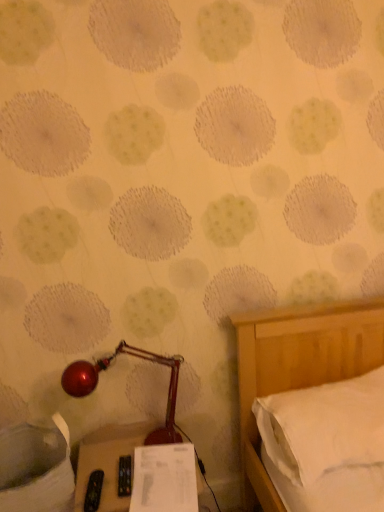
This screenshot has height=512, width=384. What do you see at coordinates (108, 461) in the screenshot?
I see `black plastic remote control at lower center` at bounding box center [108, 461].

What do you see at coordinates (324, 426) in the screenshot? I see `white soft pillow at right` at bounding box center [324, 426].

What is the approximate height of white soft pillow at right?

white soft pillow at right is 9.24 inches in height.

The height and width of the screenshot is (512, 384). Find the location of `white paper at lower center`. white paper at lower center is located at coordinates (164, 479).

The width and height of the screenshot is (384, 512). Describe the element at coordinates (164, 479) in the screenshot. I see `white paper at lower center` at that location.

You are a GUI agent. You are given a task and a screenshot of the screen. Output one action in this format:
    pyautogui.click(x=<x>, y=<y>)
    Task: Click on the black plastic remote control at lower center
    
    Given the screenshot: What is the action you would take?
    pyautogui.click(x=108, y=461)

Is black plastic remote control at lower center directly adjacent to shiny red lamp at lower left?

black plastic remote control at lower center and shiny red lamp at lower left are clearly separated.

Is black plastic remote control at lower center taller than shiny red lamp at lower left?

Incorrect, the height of black plastic remote control at lower center is not larger of that of shiny red lamp at lower left.

What's the angular difference between black plastic remote control at lower center and shiny red lamp at lower left's facing directions?

The angle between the facing direction of black plastic remote control at lower center and the facing direction of shiny red lamp at lower left is 12.9 degrees.

Considering the positions of objects black plastic remote control at lower center and shiny red lamp at lower left in the image provided, who is more to the left, black plastic remote control at lower center or shiny red lamp at lower left?

From the viewer's perspective, shiny red lamp at lower left appears more on the left side.

Can you confirm if white soft pillow at right is wider than shiny red lamp at lower left?

Correct, the width of white soft pillow at right exceeds that of shiny red lamp at lower left.

From the image's perspective, between white soft pillow at right and shiny red lamp at lower left, who is located below?

white soft pillow at right, from the image's perspective.

Is white soft pillow at right positioned in front of shiny red lamp at lower left?

That is True.

Is white soft pillow at right turned away from shiny red lamp at lower left?

That's not correct — white soft pillow at right is not looking away from shiny red lamp at lower left.

Which of these two, white paper at lower center or white soft pillow at right, is smaller?

white paper at lower center.

Where is `paper below the white soft pillow at right (from the image's perspective)`? paper below the white soft pillow at right (from the image's perspective) is located at coordinates (164, 479).

Is white paper at lower center oriented away from white soft pillow at right?

No, white paper at lower center is not facing away from white soft pillow at right.

How different are the orientations of white paper at lower center and white soft pillow at right in degrees?

8.12 degrees separate the facing orientations of white paper at lower center and white soft pillow at right.

Considering the sizes of objects shiny red lamp at lower left and white soft pillow at right in the image provided, who is bigger, shiny red lamp at lower left or white soft pillow at right?

With larger size is white soft pillow at right.

Is white soft pillow at right completely or partially inside shiny red lamp at lower left?

No, white soft pillow at right is not inside shiny red lamp at lower left.

From the image's perspective, is shiny red lamp at lower left located above white soft pillow at right?

Yes, from the image's perspective, shiny red lamp at lower left is over white soft pillow at right.

How many degrees apart are the facing directions of shiny red lamp at lower left and white soft pillow at right?

12.8 degrees.

Could you tell me if white paper at lower center is facing shiny red lamp at lower left?

No.

Considering the positions of objects white paper at lower center and shiny red lamp at lower left in the image provided, who is more to the right, white paper at lower center or shiny red lamp at lower left?

Positioned to the right is white paper at lower center.

There is a white paper at lower center. Where is `lamp above it (from a real-world perspective)`? lamp above it (from a real-world perspective) is located at coordinates (107, 368).

Is white paper at lower center thinner than shiny red lamp at lower left?

No.

Considering the relative positions of white soft pillow at right and black plastic remote control at lower center in the image provided, is white soft pillow at right to the right of black plastic remote control at lower center from the viewer's perspective?

Yes.

Does white soft pillow at right lie in front of black plastic remote control at lower center?

No, the depth of white soft pillow at right is greater than that of black plastic remote control at lower center.

Is white soft pillow at right taller than black plastic remote control at lower center?

In fact, white soft pillow at right may be shorter than black plastic remote control at lower center.

From a real-world perspective, who is located higher, black plastic remote control at lower center or white soft pillow at right?

white soft pillow at right.

How different are the orientations of black plastic remote control at lower center and white soft pillow at right in degrees?

The facing directions of black plastic remote control at lower center and white soft pillow at right are 0.023 degrees apart.

Is black plastic remote control at lower center next to white soft pillow at right?

No.

Based on their sizes in the image, would you say black plastic remote control at lower center is bigger or smaller than white soft pillow at right?

Clearly, black plastic remote control at lower center is larger in size than white soft pillow at right.

Identify the location of furniture below the shiny red lamp at lower left (from the image's perspective). [x=108, y=461].

The height and width of the screenshot is (512, 384). Find the location of `lamp that is above the white soft pillow at right (from the image's perspective)`. lamp that is above the white soft pillow at right (from the image's perspective) is located at coordinates (107, 368).

Estimate the real-world distances between objects in this image. Which object is closer to shiny red lamp at lower left, white paper at lower center or white soft pillow at right?

The object closer to shiny red lamp at lower left is white paper at lower center.

When comparing their distances from white soft pillow at right, does black plastic remote control at lower center or white paper at lower center seem further?

black plastic remote control at lower center is further to white soft pillow at right.

Which object lies nearer to the anchor point shiny red lamp at lower left, white soft pillow at right or white paper at lower center?

white paper at lower center is closer to shiny red lamp at lower left.

Considering their positions, is white paper at lower center positioned further to white soft pillow at right than black plastic remote control at lower center?

black plastic remote control at lower center is positioned further to the anchor white soft pillow at right.

From the image, which object appears to be nearer to white soft pillow at right, shiny red lamp at lower left or white paper at lower center?

The object closer to white soft pillow at right is white paper at lower center.

Based on their spatial positions, is white soft pillow at right or white paper at lower center further from black plastic remote control at lower center?

white soft pillow at right is further to black plastic remote control at lower center.

Considering their positions, is black plastic remote control at lower center positioned closer to white soft pillow at right than shiny red lamp at lower left?

Among the two, shiny red lamp at lower left is located nearer to white soft pillow at right.

Based on their spatial positions, is white soft pillow at right or shiny red lamp at lower left further from black plastic remote control at lower center?

white soft pillow at right lies further to black plastic remote control at lower center than the other object.

Find the location of a particular element. This screenshot has height=512, width=384. furniture located between shiny red lamp at lower left and white soft pillow at right in the left-right direction is located at coordinates (108, 461).

This screenshot has width=384, height=512. I want to click on paper between shiny red lamp at lower left and white soft pillow at right from left to right, so [164, 479].

Find the location of `paper between black plastic remote control at lower center and white soft pillow at right`. paper between black plastic remote control at lower center and white soft pillow at right is located at coordinates (164, 479).

Identify the location of paper between shiny red lamp at lower left and black plastic remote control at lower center in the up-down direction. The width and height of the screenshot is (384, 512). (164, 479).